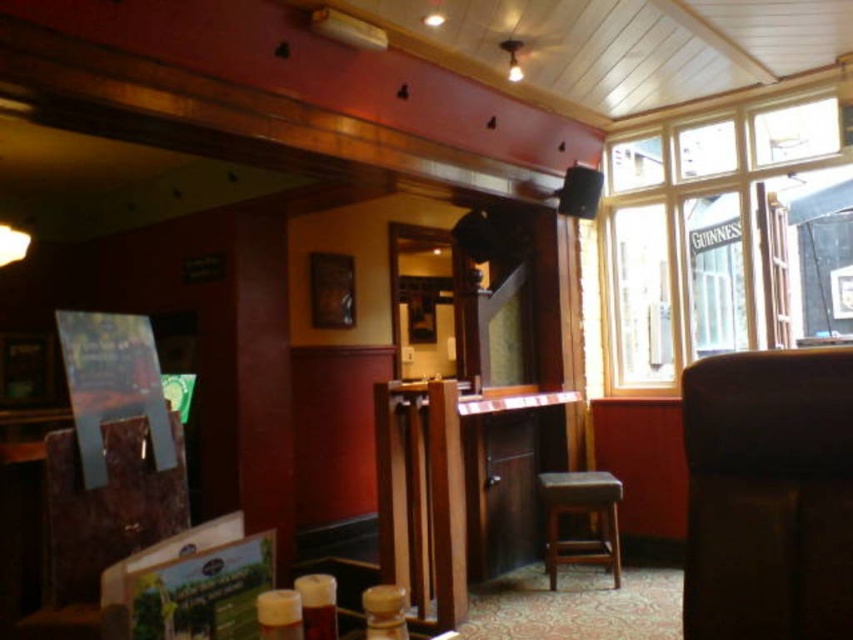
Question: Estimate the real-world distances between objects in this image. Which object is farther from the black leather chair at right?

Choices:
 (A) clear glass window at upper right
 (B) dark brown leather stool at center

Answer: (A)

Question: Does clear glass window at upper right have a larger size compared to dark brown leather stool at center?

Choices:
 (A) yes
 (B) no

Answer: (A)

Question: Can you confirm if clear glass window at upper right is positioned to the right of black leather chair at right?

Choices:
 (A) yes
 (B) no

Answer: (A)

Question: Which object appears closest to the camera in this image?

Choices:
 (A) black leather chair at right
 (B) clear glass window at upper right

Answer: (A)

Question: Which point is farther to the camera?

Choices:
 (A) (578, 493)
 (B) (836, 454)

Answer: (A)

Question: Where is black leather chair at right located in relation to dark brown leather stool at center in the image?

Choices:
 (A) above
 (B) below

Answer: (A)